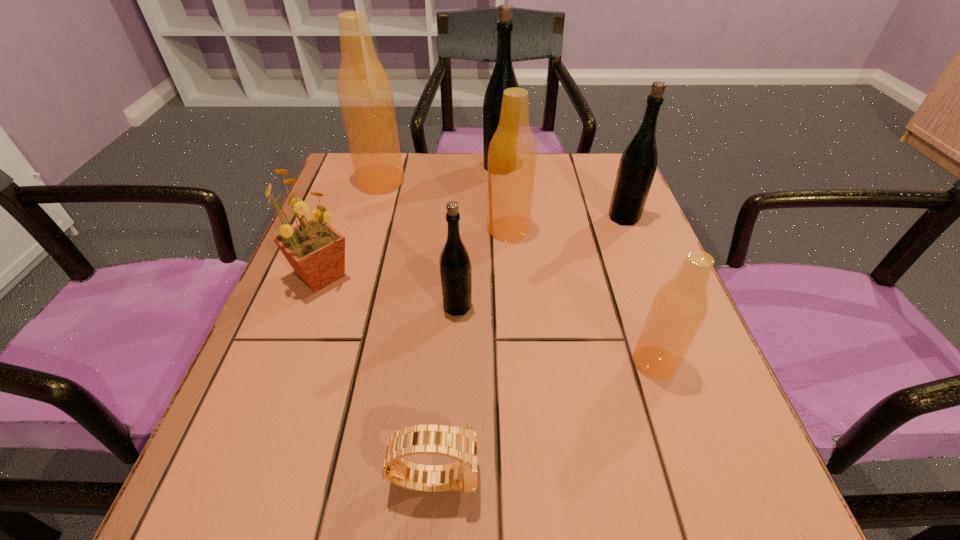
Locate an element on the screen. Image resolution: width=960 pixels, height=540 pixels. free space between the second green beer bottle from right to left and the nearest green beer bottle is located at coordinates (479, 237).

The height and width of the screenshot is (540, 960). What are the coordinates of `free spot between the sunflower and the nearest tan beer bottle` in the screenshot? It's located at (488, 319).

Locate an element on the screen. vacant point located between the smallest tan beer bottle and the farthest green beer bottle is located at coordinates (577, 265).

You are a GUI agent. You are given a task and a screenshot of the screen. Output one action in this format:
    pyautogui.click(x=<x>, y=<y>)
    Task: Click on the object that can be found as the seventh closest to the farthest green beer bottle
    The width and height of the screenshot is (960, 540).
    Given the screenshot: What is the action you would take?
    pyautogui.click(x=461, y=444)

Choose which object is the third nearest neighbor to the farthest tan beer bottle. Please provide its 2D coordinates. Your answer should be formatted as a tuple, i.e. [(x, y)], where the tuple contains the x and y coordinates of a point satisfying the conditions above.

[(512, 155)]

Select which beer bottle is the closest to the black watch. Please provide its 2D coordinates. Your answer should be formatted as a tuple, i.e. [(x, y)], where the tuple contains the x and y coordinates of a point satisfying the conditions above.

[(455, 267)]

This screenshot has width=960, height=540. Find the location of `beer bottle that is the fifth closest to the second farthest green beer bottle`. beer bottle that is the fifth closest to the second farthest green beer bottle is located at coordinates (364, 90).

Find the location of a particular element. the closest green beer bottle relative to the nearest beer bottle is located at coordinates (455, 267).

Select which green beer bottle appears as the third closest to the second tan beer bottle from left to right. Please provide its 2D coordinates. Your answer should be formatted as a tuple, i.e. [(x, y)], where the tuple contains the x and y coordinates of a point satisfying the conditions above.

[(638, 163)]

Choose which tan beer bottle is the second nearest neighbor to the nearest green beer bottle. Please provide its 2D coordinates. Your answer should be formatted as a tuple, i.e. [(x, y)], where the tuple contains the x and y coordinates of a point satisfying the conditions above.

[(680, 306)]